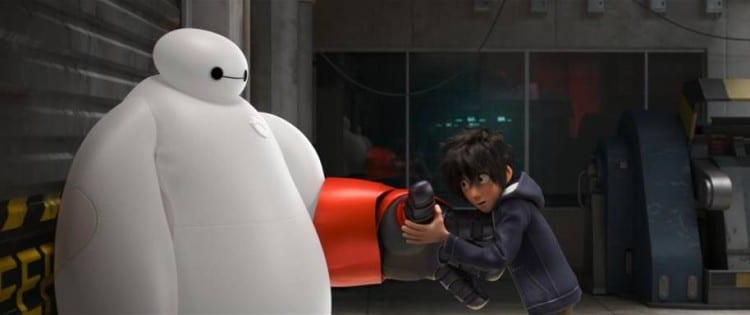
Find the location of a particular element. The height and width of the screenshot is (315, 750). window is located at coordinates (564, 116).